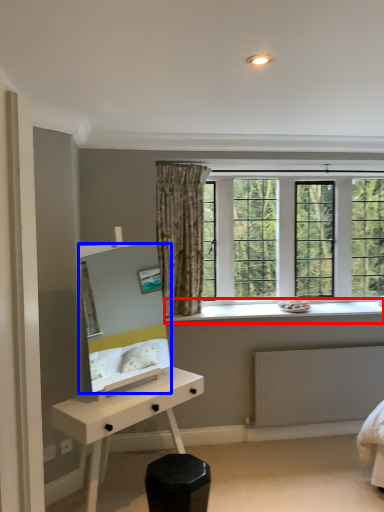
Question: Among these objects, which one is nearest to the camera, window sill (highlighted by a red box) or mirror (highlighted by a blue box)?

Choices:
 (A) window sill
 (B) mirror

Answer: (B)